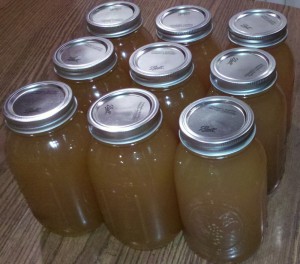
This screenshot has height=264, width=300. I want to click on center column of jars, so click(x=153, y=157), click(x=173, y=105), click(x=201, y=53).